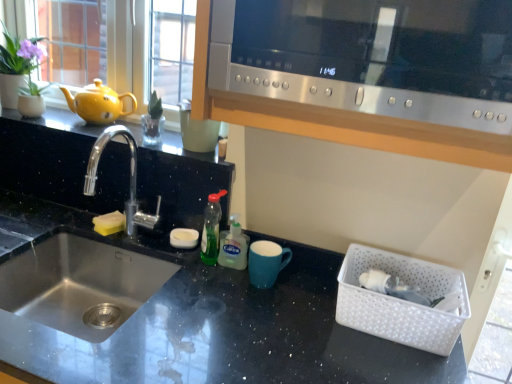
The image size is (512, 384). Identify the location of vacant region in front of green translucent bottle at center, the 1th bottle from the left. (209, 285).